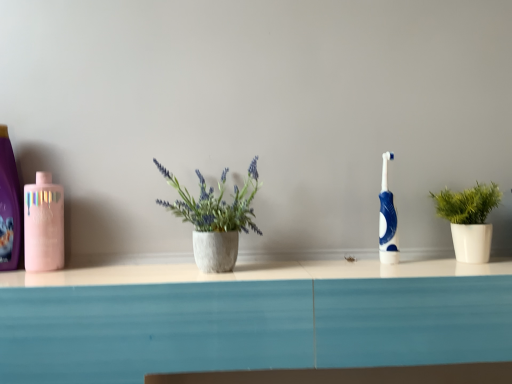
Question: From the image's perspective, is white matte plant pot at right located above pink glossy mouthwash at left?

Choices:
 (A) no
 (B) yes

Answer: (A)

Question: Are white matte plant pot at right and pink glossy mouthwash at left far apart?

Choices:
 (A) yes
 (B) no

Answer: (B)

Question: Is white matte plant pot at right beside pink glossy mouthwash at left?

Choices:
 (A) no
 (B) yes

Answer: (A)

Question: Considering the relative positions of white matte plant pot at right and pink glossy mouthwash at left in the image provided, is white matte plant pot at right in front of pink glossy mouthwash at left?

Choices:
 (A) yes
 (B) no

Answer: (A)

Question: Is white matte plant pot at right smaller than pink glossy mouthwash at left?

Choices:
 (A) no
 (B) yes

Answer: (A)

Question: Is white matte plant pot at right inside or outside of matte pink bottle at left?

Choices:
 (A) outside
 (B) inside

Answer: (A)

Question: From the image's perspective, relative to matte pink bottle at left, is white matte plant pot at right above or below?

Choices:
 (A) below
 (B) above

Answer: (A)

Question: From a real-world perspective, relative to matte pink bottle at left, is white matte plant pot at right vertically above or below?

Choices:
 (A) below
 (B) above

Answer: (A)

Question: Looking at the image, does white matte plant pot at right seem bigger or smaller compared to matte pink bottle at left?

Choices:
 (A) small
 (B) big

Answer: (B)

Question: Which is correct: blue glossy toothbrush at center-right is inside pink glossy mouthwash at left, or outside of it?

Choices:
 (A) outside
 (B) inside

Answer: (A)

Question: Considering the positions of blue glossy toothbrush at center-right and pink glossy mouthwash at left in the image, is blue glossy toothbrush at center-right wider or thinner than pink glossy mouthwash at left?

Choices:
 (A) wide
 (B) thin

Answer: (B)

Question: From a real-world perspective, relative to pink glossy mouthwash at left, is blue glossy toothbrush at center-right vertically above or below?

Choices:
 (A) below
 (B) above

Answer: (B)

Question: Based on their positions, is blue glossy toothbrush at center-right located to the left or right of pink glossy mouthwash at left?

Choices:
 (A) left
 (B) right

Answer: (B)

Question: Is point (436, 201) closer or farther from the camera than point (382, 157)?

Choices:
 (A) farther
 (B) closer

Answer: (B)

Question: From a real-world perspective, relative to blue glossy toothbrush at center-right, is white matte plant pot at right vertically above or below?

Choices:
 (A) below
 (B) above

Answer: (A)